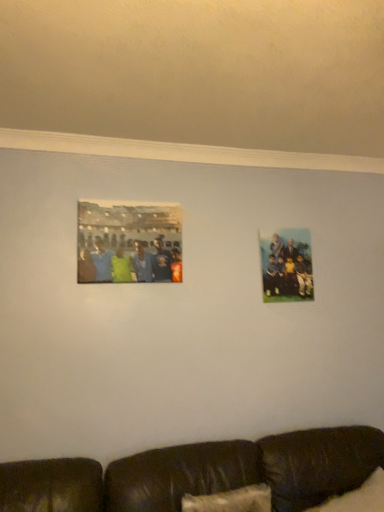
What do you see at coordinates (200, 473) in the screenshot? I see `brown leather couch at lower center` at bounding box center [200, 473].

Image resolution: width=384 pixels, height=512 pixels. I want to click on white fluffy pillow at lower right, so click(x=358, y=497).

Describe the element at coordinates (358, 497) in the screenshot. I see `white fluffy pillow at lower right` at that location.

Locate an element on the screen. The image size is (384, 512). matte plastic photo frame at upper left, placed as the 1th picture frame when sorted from left to right is located at coordinates (129, 242).

Locate an element on the screen. This screenshot has width=384, height=512. matte plastic photo frame at right, acting as the 1th picture frame starting from the right is located at coordinates 287,266.

I want to click on brown leather couch at lower center, so click(x=200, y=473).

Which is in front, matte plastic photo frame at upper left, the first picture frame positioned from the front, or matte plastic photo frame at right, the first picture frame from the back?

matte plastic photo frame at upper left, the first picture frame positioned from the front.

Measure the distance between matte plastic photo frame at upper left, the 2th picture frame viewed from the right, and matte plastic photo frame at right, the first picture frame from the back.

matte plastic photo frame at upper left, the 2th picture frame viewed from the right, and matte plastic photo frame at right, the first picture frame from the back, are 67.59 centimeters apart.

In the scene shown: Can you confirm if matte plastic photo frame at upper left, the first picture frame positioned from the front, is positioned to the right of matte plastic photo frame at right, the second picture frame viewed from the left?

Incorrect, matte plastic photo frame at upper left, the first picture frame positioned from the front, is not on the right side of matte plastic photo frame at right, the second picture frame viewed from the left.

From a real-world perspective, relative to matte plastic photo frame at right, the second picture frame viewed from the left, is matte plastic photo frame at upper left, placed as the 1th picture frame when sorted from left to right, vertically above or below?

In terms of real-world spatial position, matte plastic photo frame at upper left, placed as the 1th picture frame when sorted from left to right, is above matte plastic photo frame at right, the second picture frame viewed from the left.

From a real-world perspective, does matte plastic photo frame at right, the first picture frame from the back, stand above matte plastic photo frame at upper left, which appears as the second picture frame when viewed from the back?

Actually, matte plastic photo frame at right, the first picture frame from the back, is physically below matte plastic photo frame at upper left, which appears as the second picture frame when viewed from the back, in the real world.

From the picture: Who is smaller, matte plastic photo frame at right, acting as the 1th picture frame starting from the right, or matte plastic photo frame at upper left, placed as the 1th picture frame when sorted from left to right?

With smaller size is matte plastic photo frame at right, acting as the 1th picture frame starting from the right.

From the image's perspective, which is below, matte plastic photo frame at right, the second picture frame viewed from the left, or matte plastic photo frame at upper left, which appears as the second picture frame when viewed from the back?

From the image's view, matte plastic photo frame at right, the second picture frame viewed from the left, is below.

What's the angular difference between matte plastic photo frame at right, the first picture frame from the back, and matte plastic photo frame at upper left, the 2th picture frame viewed from the right,'s facing directions?

The facing directions of matte plastic photo frame at right, the first picture frame from the back, and matte plastic photo frame at upper left, the 2th picture frame viewed from the right, are 0.0118 degrees apart.

Based on the photo, from the image's perspective, is brown leather couch at lower center beneath matte plastic photo frame at right, acting as the 1th picture frame starting from the right?

Yes.

Does brown leather couch at lower center have a smaller size compared to matte plastic photo frame at right, the second picture frame viewed from the left?

Actually, brown leather couch at lower center might be larger than matte plastic photo frame at right, the second picture frame viewed from the left.

Considering the relative positions of brown leather couch at lower center and matte plastic photo frame at right, the second picture frame viewed from the left, in the image provided, is brown leather couch at lower center to the left of matte plastic photo frame at right, the second picture frame viewed from the left, from the viewer's perspective?

Correct, you'll find brown leather couch at lower center to the left of matte plastic photo frame at right, the second picture frame viewed from the left.

Considering the positions of objects matte plastic photo frame at upper left, placed as the 1th picture frame when sorted from left to right, and brown leather couch at lower center in the image provided, who is more to the right, matte plastic photo frame at upper left, placed as the 1th picture frame when sorted from left to right, or brown leather couch at lower center?

From the viewer's perspective, brown leather couch at lower center appears more on the right side.

Is matte plastic photo frame at upper left, the 2th picture frame viewed from the right, in contact with brown leather couch at lower center?

No, matte plastic photo frame at upper left, the 2th picture frame viewed from the right, is not touching brown leather couch at lower center.

What's the angular difference between matte plastic photo frame at upper left, placed as the 1th picture frame when sorted from left to right, and brown leather couch at lower center's facing directions?

The angular difference between matte plastic photo frame at upper left, placed as the 1th picture frame when sorted from left to right, and brown leather couch at lower center is 0.0977 degrees.

From the image's perspective, is matte plastic photo frame at right, acting as the 1th picture frame starting from the right, located above or below brown leather couch at lower center?

Based on their image positions, matte plastic photo frame at right, acting as the 1th picture frame starting from the right, is located above brown leather couch at lower center.

From a real-world perspective, who is located lower, matte plastic photo frame at right, the second picture frame viewed from the left, or brown leather couch at lower center?

brown leather couch at lower center, from a real-world perspective.

From their relative heights in the image, would you say matte plastic photo frame at right, acting as the 1th picture frame starting from the right, is taller or shorter than brown leather couch at lower center?

Clearly, matte plastic photo frame at right, acting as the 1th picture frame starting from the right, is shorter compared to brown leather couch at lower center.

Which is correct: matte plastic photo frame at upper left, the 2th picture frame viewed from the right, is inside white fluffy pillow at lower right, or outside of it?

matte plastic photo frame at upper left, the 2th picture frame viewed from the right, cannot be found inside white fluffy pillow at lower right.

From a real-world perspective, is matte plastic photo frame at upper left, placed as the 1th picture frame when sorted from left to right, physically located above or below white fluffy pillow at lower right?

matte plastic photo frame at upper left, placed as the 1th picture frame when sorted from left to right, is above white fluffy pillow at lower right.

How many degrees apart are the facing directions of matte plastic photo frame at upper left, which appears as the second picture frame when viewed from the back, and white fluffy pillow at lower right?

matte plastic photo frame at upper left, which appears as the second picture frame when viewed from the back, and white fluffy pillow at lower right are facing 18.6 degrees away from each other.

Based on their sizes in the image, would you say matte plastic photo frame at upper left, the 2th picture frame viewed from the right, is bigger or smaller than white fluffy pillow at lower right?

matte plastic photo frame at upper left, the 2th picture frame viewed from the right, is smaller than white fluffy pillow at lower right.

From the picture: Considering the positions of objects brown leather couch at lower center and matte plastic photo frame at upper left, placed as the 1th picture frame when sorted from left to right, in the image provided, who is behind, brown leather couch at lower center or matte plastic photo frame at upper left, placed as the 1th picture frame when sorted from left to right,?

matte plastic photo frame at upper left, placed as the 1th picture frame when sorted from left to right.

Between brown leather couch at lower center and matte plastic photo frame at upper left, the first picture frame positioned from the front, which one has larger size?

brown leather couch at lower center.

From the image's perspective, is brown leather couch at lower center under matte plastic photo frame at upper left, the first picture frame positioned from the front?

Yes, from the image's perspective, brown leather couch at lower center is beneath matte plastic photo frame at upper left, the first picture frame positioned from the front.

Is brown leather couch at lower center looking in the opposite direction of matte plastic photo frame at upper left, the 2th picture frame viewed from the right?

No, brown leather couch at lower center is not facing away from matte plastic photo frame at upper left, the 2th picture frame viewed from the right.

In the image, there is a matte plastic photo frame at upper left, the first picture frame positioned from the front. Where is `picture frame below it (from the image's perspective)`? picture frame below it (from the image's perspective) is located at coordinates (287, 266).

This screenshot has width=384, height=512. Find the location of `picture frame behind the matte plastic photo frame at upper left, the 2th picture frame viewed from the right`. picture frame behind the matte plastic photo frame at upper left, the 2th picture frame viewed from the right is located at coordinates pyautogui.click(x=287, y=266).

Based on their spatial positions, is white fluffy pillow at lower right or matte plastic photo frame at upper left, the first picture frame positioned from the front, further from matte plastic photo frame at right, which is counted as the 2th picture frame, starting from the front?

The object further to matte plastic photo frame at right, which is counted as the 2th picture frame, starting from the front, is white fluffy pillow at lower right.

Based on the photo, when comparing their distances from brown leather couch at lower center, does matte plastic photo frame at right, the second picture frame viewed from the left, or white fluffy pillow at lower right seem closer?

white fluffy pillow at lower right is closer to brown leather couch at lower center.

Looking at the image, which one is located further to brown leather couch at lower center, white fluffy pillow at lower right or matte plastic photo frame at right, acting as the 1th picture frame starting from the right?

matte plastic photo frame at right, acting as the 1th picture frame starting from the right, is further to brown leather couch at lower center.

Estimate the real-world distances between objects in this image. Which object is closer to white fluffy pillow at lower right, matte plastic photo frame at right, which is counted as the 2th picture frame, starting from the front, or brown leather couch at lower center?

brown leather couch at lower center is closer to white fluffy pillow at lower right.

Based on their spatial positions, is brown leather couch at lower center or matte plastic photo frame at upper left, the first picture frame positioned from the front, further from matte plastic photo frame at right, the first picture frame from the back?

The object further to matte plastic photo frame at right, the first picture frame from the back, is brown leather couch at lower center.

When comparing their distances from white fluffy pillow at lower right, does matte plastic photo frame at right, the first picture frame from the back, or matte plastic photo frame at upper left, placed as the 1th picture frame when sorted from left to right, seem closer?

matte plastic photo frame at right, the first picture frame from the back, is closer to white fluffy pillow at lower right.

When comparing their distances from matte plastic photo frame at upper left, placed as the 1th picture frame when sorted from left to right, does white fluffy pillow at lower right or brown leather couch at lower center seem closer?

brown leather couch at lower center is closer to matte plastic photo frame at upper left, placed as the 1th picture frame when sorted from left to right.

Which object lies nearer to the anchor point matte plastic photo frame at upper left, the 2th picture frame viewed from the right, white fluffy pillow at lower right or matte plastic photo frame at right, the second picture frame viewed from the left?

matte plastic photo frame at right, the second picture frame viewed from the left.

This screenshot has height=512, width=384. Identify the location of picture frame between matte plastic photo frame at upper left, the first picture frame positioned from the front, and brown leather couch at lower center from top to bottom. (287, 266).

I want to click on picture frame between matte plastic photo frame at upper left, placed as the 1th picture frame when sorted from left to right, and white fluffy pillow at lower right from top to bottom, so click(x=287, y=266).

Locate an element on the screen. This screenshot has width=384, height=512. pillow located between brown leather couch at lower center and matte plastic photo frame at right, which is counted as the 2th picture frame, starting from the front, in the depth direction is located at coordinates (358, 497).

Locate an element on the screen. This screenshot has width=384, height=512. pillow between matte plastic photo frame at upper left, which appears as the second picture frame when viewed from the back, and brown leather couch at lower center, in the vertical direction is located at coordinates (358, 497).